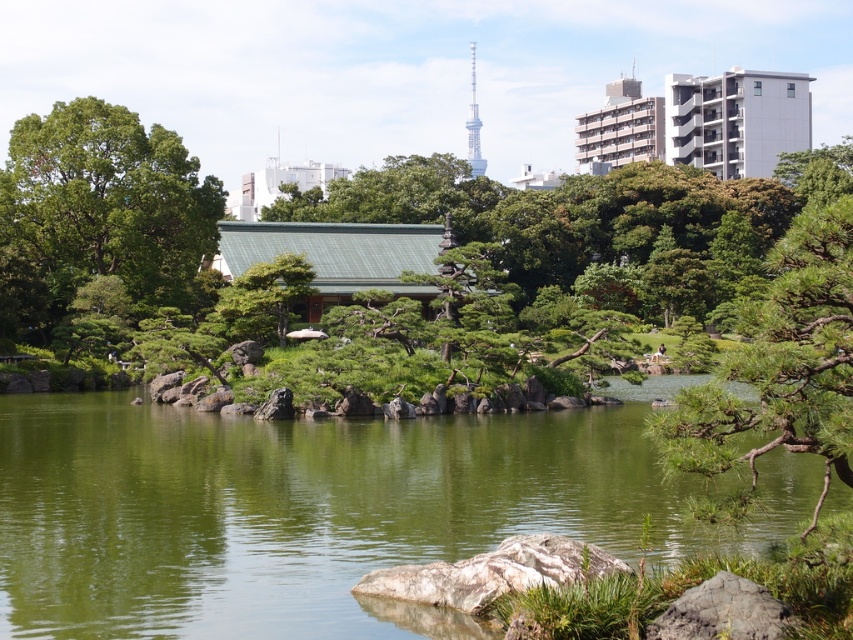
Which is behind, point (677, 625) or point (286, 288)?

The point (286, 288) is more distant.

Does gray rough stone at lower right lie in front of green textured tree at center?

Yes, gray rough stone at lower right is in front of green textured tree at center.

Based on the photo, who is more distant from viewer, (688, 600) or (297, 285)?

The point (297, 285) is more distant.

Where is `gray rough stone at lower right`? The image size is (853, 640). gray rough stone at lower right is located at coordinates (723, 612).

Which of these two, green leafy tree at upper left or green textured pine tree at center-right, stands shorter?

Standing shorter between the two is green leafy tree at upper left.

Locate an element on the screen. green leafy tree at upper left is located at coordinates (97, 212).

Where is `green leafy tree at upper left`? green leafy tree at upper left is located at coordinates (97, 212).

Who is more distant from viewer, (109,132) or (267,276)?

The point (109,132) is behind.

Where is `green leafy tree at upper left`? green leafy tree at upper left is located at coordinates (97, 212).